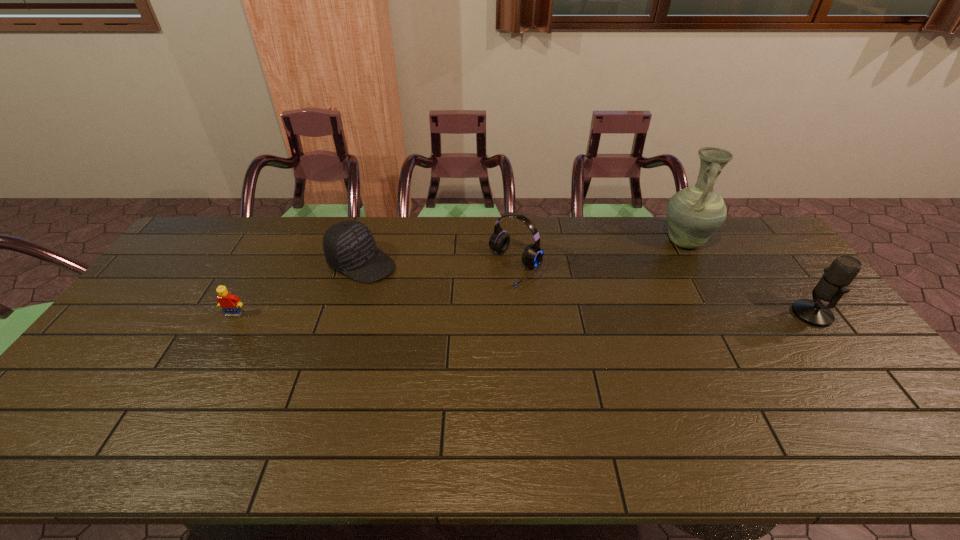
The image size is (960, 540). What are the coordinates of `free space between the shortest object and the microphone` in the screenshot? It's located at (523, 314).

Where is `vacant space in between the fourth tallest object and the microphone`? vacant space in between the fourth tallest object and the microphone is located at coordinates (587, 288).

Image resolution: width=960 pixels, height=540 pixels. What are the coordinates of `unoccupied area between the rightmost object and the baseball cap` in the screenshot? It's located at (587, 288).

What are the coordinates of `free space between the microphone and the second object from left to right` in the screenshot? It's located at (587, 288).

You are a GUI agent. You are given a task and a screenshot of the screen. Output one action in this format:
    pyautogui.click(x=<x>, y=<y>)
    Task: Click on the vacant area that lies between the third object from left to right and the shortest object
    The height and width of the screenshot is (540, 960).
    Given the screenshot: What is the action you would take?
    pyautogui.click(x=375, y=291)

Locate an element on the screen. empty space between the headset and the rightmost object is located at coordinates (664, 291).

Identify the location of unoccupied area between the second object from right to left and the headset. Image resolution: width=960 pixels, height=540 pixels. (600, 254).

The width and height of the screenshot is (960, 540). What are the coordinates of `free space between the microphone and the pitcher` in the screenshot? It's located at (748, 278).

The image size is (960, 540). Identify the location of object that is the fourth closest one to the rightmost object. (229, 303).

Select which object appears as the third closest to the second object from left to right. Please provide its 2D coordinates. Your answer should be formatted as a tuple, i.e. [(x, y)], where the tuple contains the x and y coordinates of a point satisfying the conditions above.

[(694, 213)]